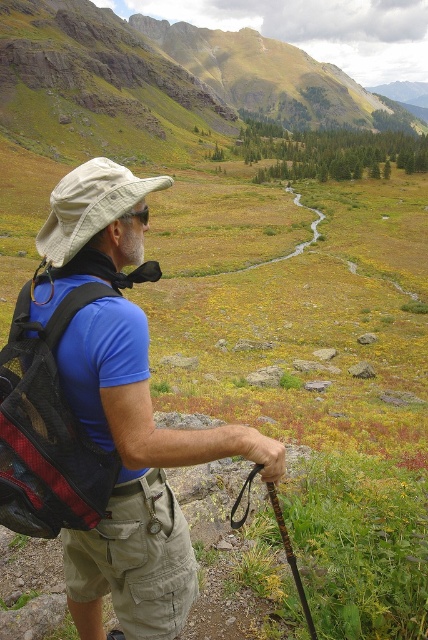
Between point (77, 301) and point (125, 548), which one is positioned in front?

Point (77, 301)

Is red mesh backpack at left taller than khakimaterial/texture shorts at lower center?

Incorrect, red mesh backpack at left's height is not larger of khakimaterial/texture shorts at lower center's.

Where is `red mesh backpack at left`? red mesh backpack at left is located at coordinates (47, 429).

Can you confirm if matte blue shirt at center is thinner than khakimaterial/texture shorts at lower center?

No.

Does matte blue shirt at center appear on the right side of khakimaterial/texture shorts at lower center?

In fact, matte blue shirt at center is to the left of khakimaterial/texture shorts at lower center.

This screenshot has width=428, height=640. Describe the element at coordinates (136, 480) in the screenshot. I see `matte blue shirt at center` at that location.

Find the location of a particular element. This screenshot has height=640, width=428. matte blue shirt at center is located at coordinates coord(136,480).

This screenshot has height=640, width=428. What do you see at coordinates (136, 480) in the screenshot?
I see `matte blue shirt at center` at bounding box center [136, 480].

Is matte blue shirt at center to the left of red mesh backpack at left from the viewer's perspective?

Correct, you'll find matte blue shirt at center to the left of red mesh backpack at left.

Locate an element on the screen. matte blue shirt at center is located at coordinates (136, 480).

Find the location of `matte blue shirt at center`. matte blue shirt at center is located at coordinates (136, 480).